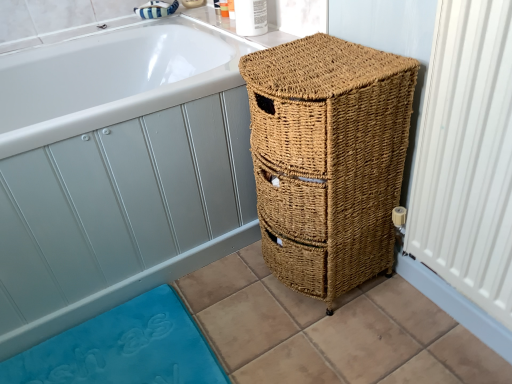
Measure the distance between white glossy bathtub at upper left and camera.

The depth of white glossy bathtub at upper left is 83.63 centimeters.

Where is `white glossy bathtub at upper left`? white glossy bathtub at upper left is located at coordinates (119, 168).

Is blue rubber bath mat at lower left turned away from white glossy bathtub at upper left?

Yes, blue rubber bath mat at lower left is positioned with its back facing white glossy bathtub at upper left.

Considering the relative sizes of blue rubber bath mat at lower left and white glossy bathtub at upper left in the image provided, is blue rubber bath mat at lower left taller than white glossy bathtub at upper left?

No, blue rubber bath mat at lower left is not taller than white glossy bathtub at upper left.

Considering the relative positions of blue rubber bath mat at lower left and white glossy bathtub at upper left in the image provided, is blue rubber bath mat at lower left to the left or to the right of white glossy bathtub at upper left?

In the image, blue rubber bath mat at lower left appears on the right side of white glossy bathtub at upper left.

Is woven brown basket at right surrounded by white glossy bathtub at upper left?

That's incorrect, woven brown basket at right is not inside white glossy bathtub at upper left.

Does white glossy bathtub at upper left have a larger size compared to woven brown basket at right?

Yes.

Is white glossy bathtub at upper left wider or thinner than woven brown basket at right?

Considering their sizes, white glossy bathtub at upper left looks broader than woven brown basket at right.

What's the angular difference between white glossy bathtub at upper left and woven brown basket at right's facing directions?

There is a 90-degree angle between the facing directions of white glossy bathtub at upper left and woven brown basket at right.

Is white textured radiator at right taller than white glossy bathtub at upper left?

Correct, white textured radiator at right is much taller as white glossy bathtub at upper left.

Would you say white textured radiator at right is outside white glossy bathtub at upper left?

white textured radiator at right lies outside white glossy bathtub at upper left's area.

In the image, is white textured radiator at right positioned in front of or behind white glossy bathtub at upper left?

Visually, white textured radiator at right is located in front of white glossy bathtub at upper left.

Considering the positions of objects woven brown basket at right and white glossy bathtub at upper left in the image provided, who is in front, woven brown basket at right or white glossy bathtub at upper left?

Positioned in front is woven brown basket at right.

From their relative heights in the image, would you say woven brown basket at right is taller or shorter than white glossy bathtub at upper left?

In the image, woven brown basket at right appears to be taller than white glossy bathtub at upper left.

Measure the distance between woven brown basket at right and white glossy bathtub at upper left.

The distance of woven brown basket at right from white glossy bathtub at upper left is 13.50 inches.

Does white glossy bathtub at upper left have a smaller size compared to blue rubber bath mat at lower left?

No, white glossy bathtub at upper left is not smaller than blue rubber bath mat at lower left.

Consider the image. Which object is further away from the camera taking this photo, white glossy bathtub at upper left or blue rubber bath mat at lower left?

blue rubber bath mat at lower left is more distant.

From a real-world perspective, is white glossy bathtub at upper left physically below blue rubber bath mat at lower left?

Incorrect, from a real-world perspective, white glossy bathtub at upper left is higher than blue rubber bath mat at lower left.

Locate an element on the screen. bath in front of the blue rubber bath mat at lower left is located at coordinates (119, 168).

From the image's perspective, is white textured radiator at right below blue rubber bath mat at lower left?

No.

Does point (510, 265) come closer to viewer compared to point (206, 352)?

Yes, it is in front of point (206, 352).

From a real-world perspective, which is physically below, white textured radiator at right or blue rubber bath mat at lower left?

blue rubber bath mat at lower left is physically lower.

Which object is closer to the camera taking this photo, white textured radiator at right or blue rubber bath mat at lower left?

white textured radiator at right.

How different are the orientations of white glossy bathtub at upper left and white textured radiator at right in degrees?

91.2 degrees separate the facing orientations of white glossy bathtub at upper left and white textured radiator at right.

Does white glossy bathtub at upper left have a greater height compared to white textured radiator at right?

Incorrect, the height of white glossy bathtub at upper left is not larger of that of white textured radiator at right.

Is point (247, 143) less distant than point (419, 198)?

No, it is behind (419, 198).

Is white glossy bathtub at upper left facing towards white textured radiator at right?

Yes, white glossy bathtub at upper left is oriented towards white textured radiator at right.

Find the location of `bath mat below the white glossy bathtub at upper left (from the image's perspective)`. bath mat below the white glossy bathtub at upper left (from the image's perspective) is located at coordinates (x=123, y=348).

This screenshot has height=384, width=512. I want to click on furniture that appears above the white glossy bathtub at upper left (from a real-world perspective), so click(x=328, y=159).

Which object lies nearer to the anchor point white textured radiator at right, woven brown basket at right or blue rubber bath mat at lower left?

Based on the image, woven brown basket at right appears to be nearer to white textured radiator at right.

Which object lies further to the anchor point woven brown basket at right, blue rubber bath mat at lower left or white textured radiator at right?

blue rubber bath mat at lower left is further to woven brown basket at right.

Considering their positions, is woven brown basket at right positioned further to white textured radiator at right than white glossy bathtub at upper left?

The object further to white textured radiator at right is white glossy bathtub at upper left.

Looking at the image, which one is located closer to white textured radiator at right, white glossy bathtub at upper left or woven brown basket at right?

woven brown basket at right is closer to white textured radiator at right.

From the image, which object appears to be nearer to white glossy bathtub at upper left, white textured radiator at right or blue rubber bath mat at lower left?

blue rubber bath mat at lower left.

Looking at the image, which one is located closer to woven brown basket at right, white glossy bathtub at upper left or blue rubber bath mat at lower left?

The object closer to woven brown basket at right is white glossy bathtub at upper left.

Estimate the real-world distances between objects in this image. Which object is closer to blue rubber bath mat at lower left, woven brown basket at right or white glossy bathtub at upper left?

white glossy bathtub at upper left is closer to blue rubber bath mat at lower left.

Looking at the image, which one is located closer to woven brown basket at right, white glossy bathtub at upper left or white textured radiator at right?

Among the two, white textured radiator at right is located nearer to woven brown basket at right.

The image size is (512, 384). I want to click on bath mat between white glossy bathtub at upper left and white textured radiator at right from left to right, so point(123,348).

The width and height of the screenshot is (512, 384). Identify the location of bath mat between white glossy bathtub at upper left and woven brown basket at right from left to right. (123, 348).

The height and width of the screenshot is (384, 512). I want to click on furniture situated between blue rubber bath mat at lower left and white textured radiator at right from left to right, so click(x=328, y=159).

In order to click on furniture between white glossy bathtub at upper left and white textured radiator at right from left to right in this screenshot , I will do `click(328, 159)`.